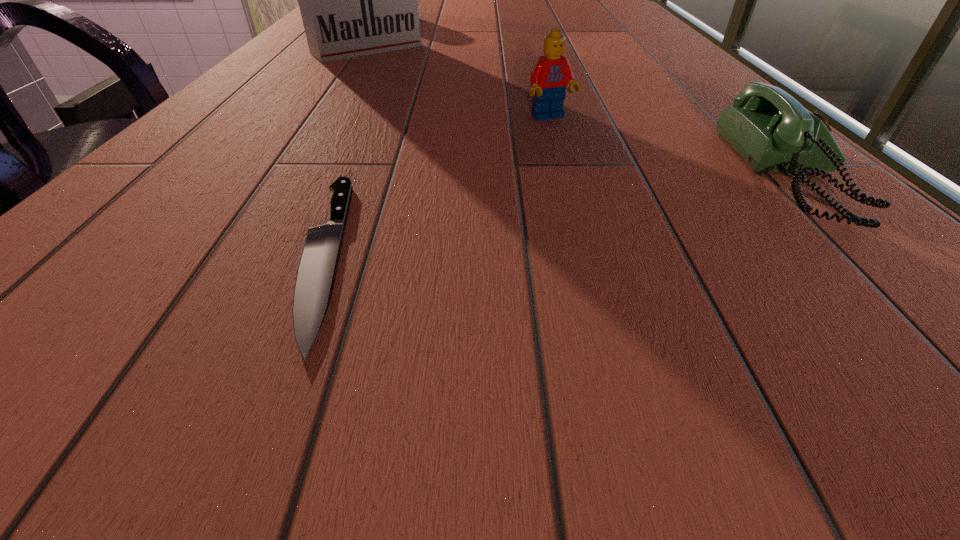
This screenshot has width=960, height=540. What are the coordinates of `vacant point located between the second shortest object and the shortest object` in the screenshot? It's located at (558, 217).

I want to click on vacant space that is in between the second tallest object and the tallest object, so click(x=458, y=83).

Locate an element on the screen. The width and height of the screenshot is (960, 540). object that is the third closest to the second shortest object is located at coordinates (355, 0).

Identify which object is the closest to the steak knife. Please provide its 2D coordinates. Your answer should be formatted as a tuple, i.e. [(x, y)], where the tuple contains the x and y coordinates of a point satisfying the conditions above.

[(551, 74)]

Locate an element on the screen. free space that satisfies the following two spatial constraints: 1. on the front side of the shortest object; 2. on the left side of the tallest object is located at coordinates (225, 256).

Find the location of `free space that satisfies the following two spatial constraints: 1. on the front side of the tallest object; 2. on the right side of the third nearest object`. free space that satisfies the following two spatial constraints: 1. on the front side of the tallest object; 2. on the right side of the third nearest object is located at coordinates (318, 118).

Where is `vacant area in the image that satisfies the following two spatial constraints: 1. on the back side of the steak knife; 2. on the left side of the third object from left to right`? vacant area in the image that satisfies the following two spatial constraints: 1. on the back side of the steak knife; 2. on the left side of the third object from left to right is located at coordinates (381, 118).

You are a GUI agent. You are given a task and a screenshot of the screen. Output one action in this format:
    pyautogui.click(x=<x>, y=<y>)
    Task: Click on the free space that satisfies the following two spatial constraints: 1. on the front side of the telephone; 2. on the dial of the third object from left to right
    
    Given the screenshot: What is the action you would take?
    pyautogui.click(x=568, y=178)